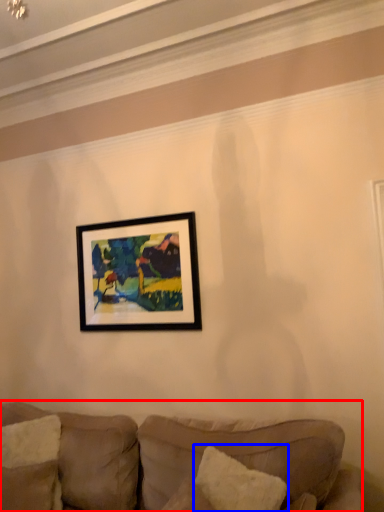
Question: Which point is closer to the camera, studio couch (highlighted by a red box) or pillow (highlighted by a blue box)?

Choices:
 (A) studio couch
 (B) pillow

Answer: (A)